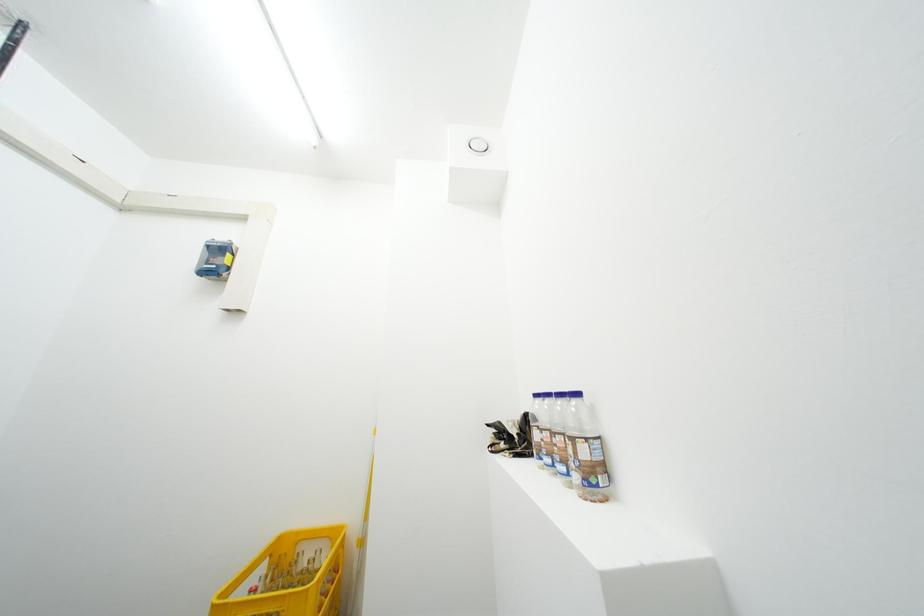
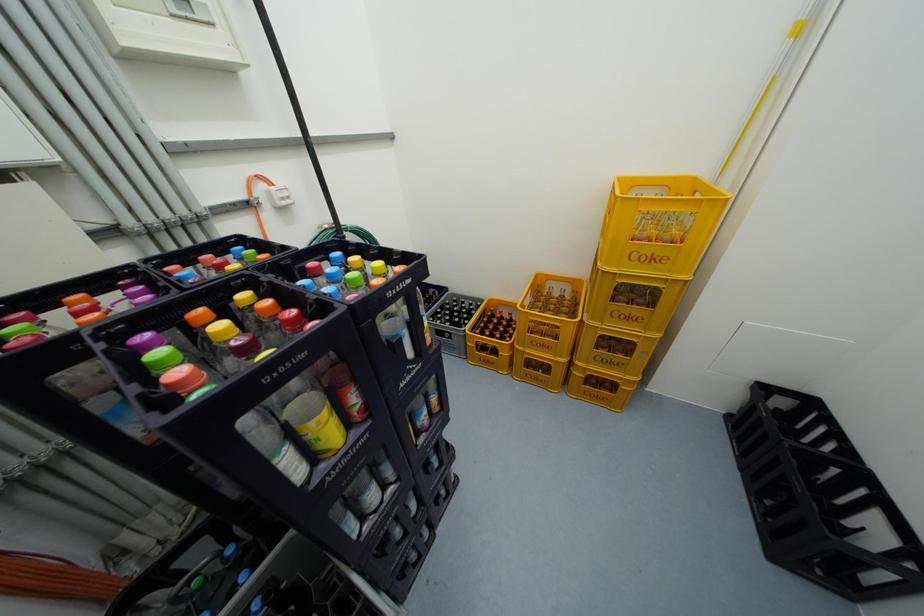
The first image is from the beginning of the video and the second image is from the end. How did the camera likely rotate when shooting the video?

The rotation direction of the camera is left-down.